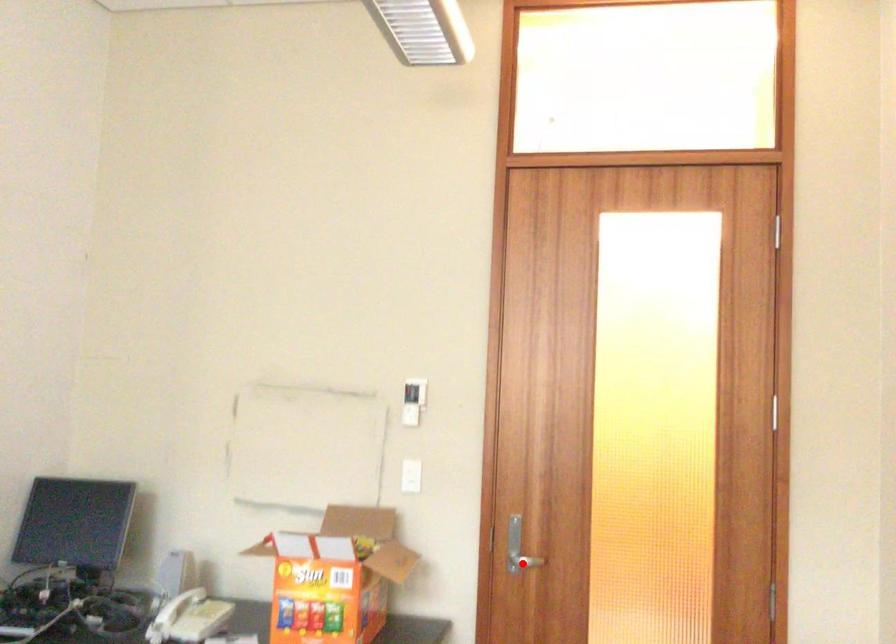
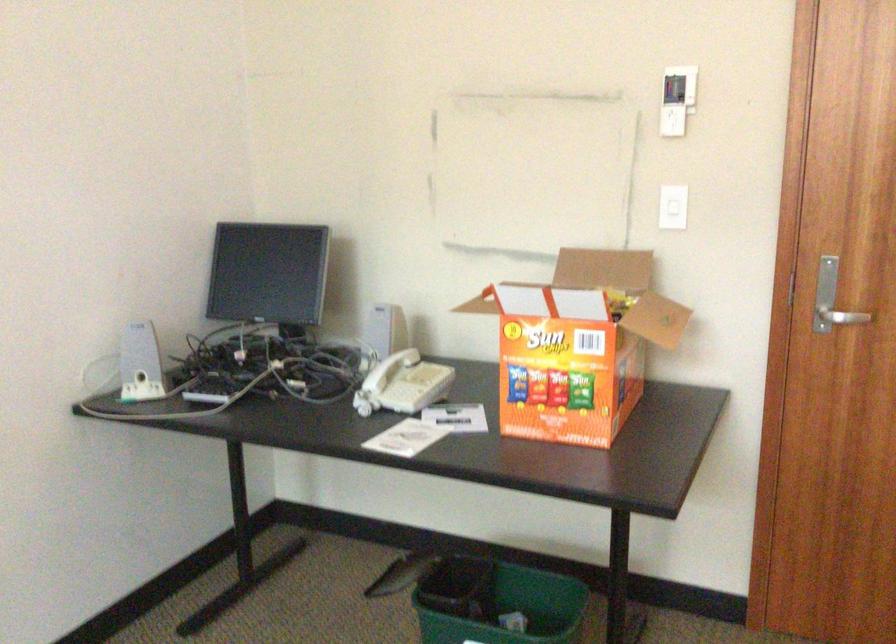
Where in the second image is the point corresponding to the highlighted location from the first image?

(842, 317)